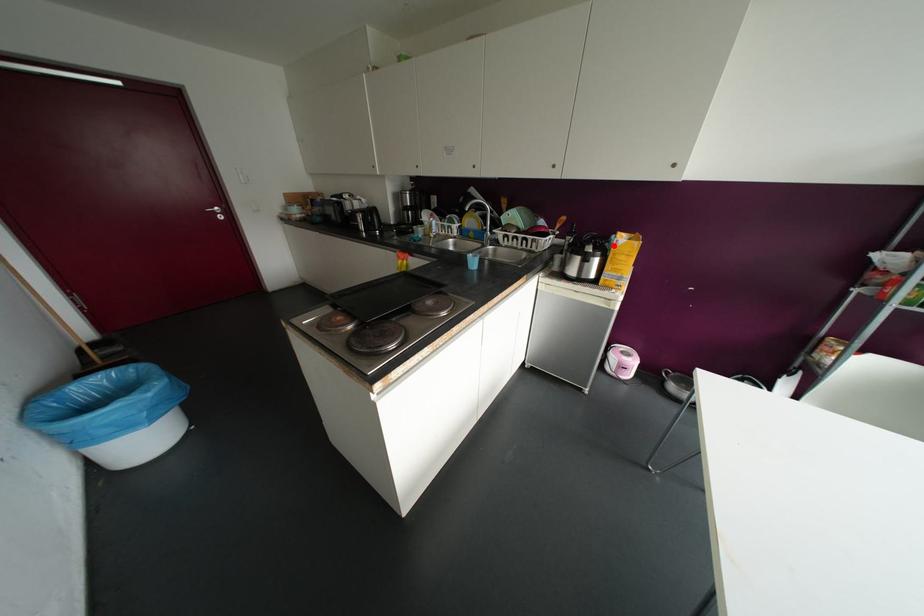
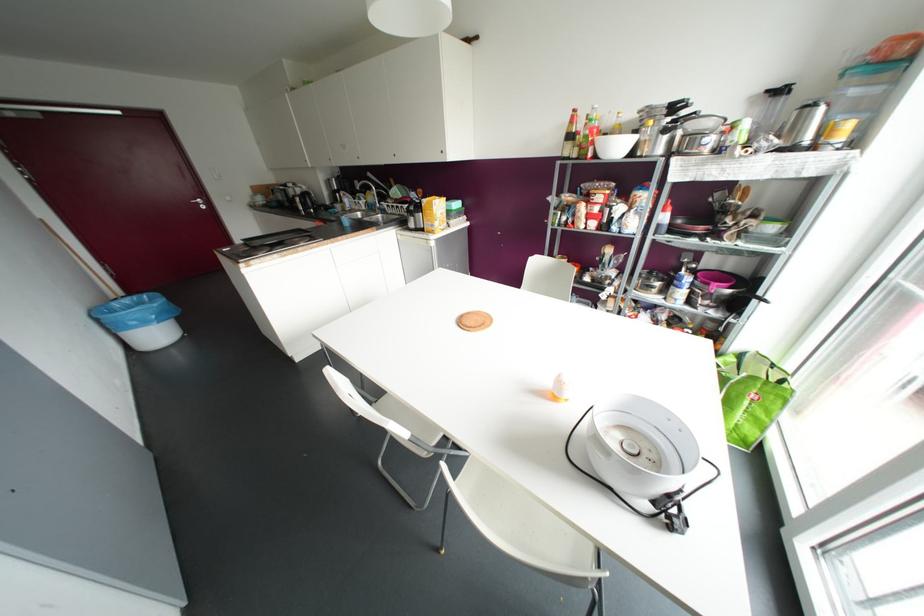
Locate, in the second image, the point that corresponds to the highlighted location in the first image.

(421, 204)